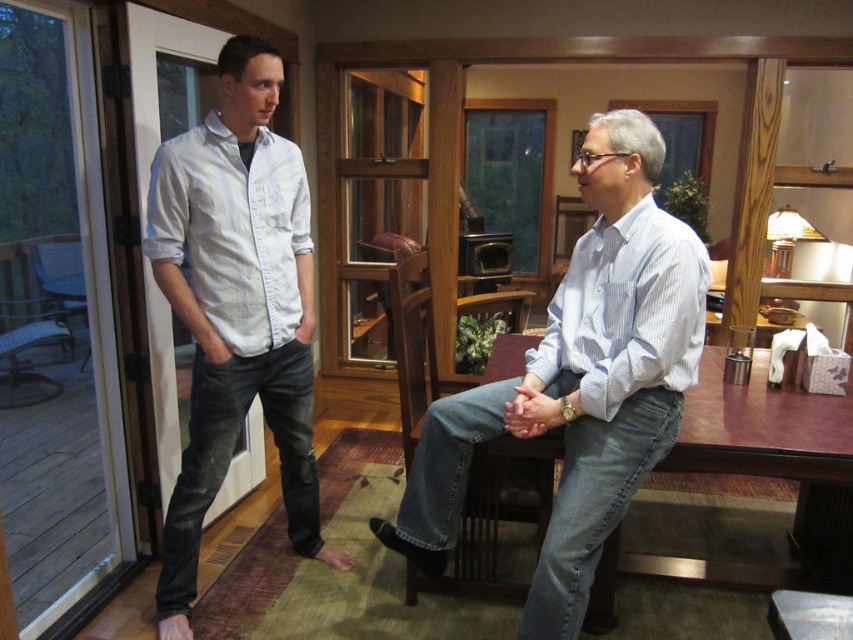
Who is lower down, light blue striped shirt at center or light blue denim jeans at left?

Positioned lower is light blue striped shirt at center.

Between light blue striped shirt at center and light blue denim jeans at left, which one appears on the left side from the viewer's perspective?

Positioned to the left is light blue denim jeans at left.

Is point (585, 609) positioned after point (207, 408)?

That is False.

Where is `light blue striped shirt at center`? light blue striped shirt at center is located at coordinates coord(579,381).